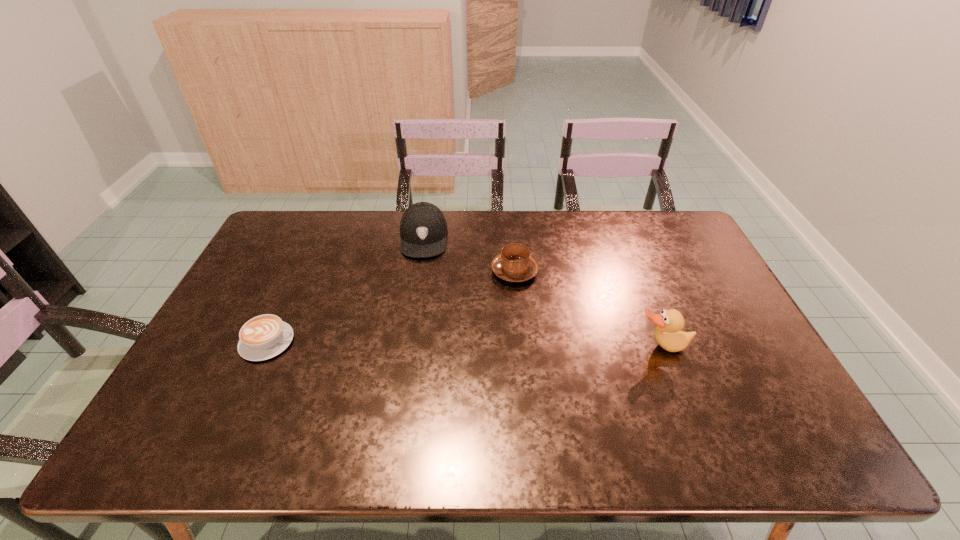
The height and width of the screenshot is (540, 960). What are the coordinates of `free spot on the desktop that is between the shorter cappuccino and the rightmost object and is positioned on the side of the third tallest object with the handle` in the screenshot? It's located at (406, 343).

Find the location of a particular element. The width and height of the screenshot is (960, 540). free spot on the desktop that is between the leftmost object and the rightmost object and is positioned on the front-facing side of the cap is located at coordinates tap(415, 343).